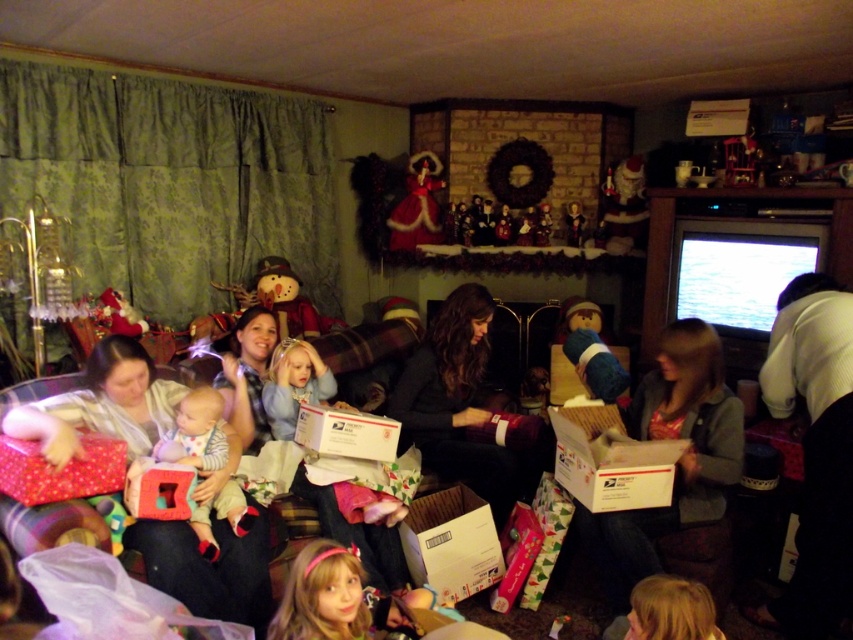
Question: Which object is the farthest from the velvet plush snowman at center?

Choices:
 (A) matte white baby at center
 (B) dark gray sweater at center
 (C) soft cotton onesie at center

Answer: (A)

Question: Can you confirm if matte white baby at center is bigger than fuzzy plush santa at upper center?

Choices:
 (A) yes
 (B) no

Answer: (A)

Question: Which point appears closest to the camera in this image?

Choices:
 (A) (682, 339)
 (B) (582, 356)
 (C) (511, 240)

Answer: (A)

Question: Can you confirm if blue plush bear at center is positioned above velvet red doll at upper center?

Choices:
 (A) yes
 (B) no

Answer: (B)

Question: Among these objects, which one is nearest to the camera?

Choices:
 (A) fuzzy plush santa at upper center
 (B) wooden nutcracker at center
 (C) shiny silver ornament at upper center

Answer: (A)

Question: Is matte white baby at center closer to the viewer compared to dark gray sweater at center?

Choices:
 (A) yes
 (B) no

Answer: (A)